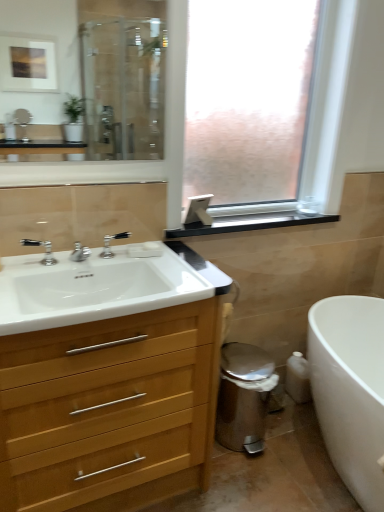
Question: Is white wood cabinet at left wider or thinner than frosted glass window at center?

Choices:
 (A) thin
 (B) wide

Answer: (B)

Question: Is point (18, 438) closer or farther from the camera than point (284, 61)?

Choices:
 (A) closer
 (B) farther

Answer: (A)

Question: Which is farther from the white matte soap at center?

Choices:
 (A) black matte window sill at upper center
 (B) white glossy bathtub at lower right
 (C) polished chrome faucet at center, the 1th tap viewed from the right
 (D) white wood cabinet at left
 (E) clear glass mirror at upper left

Answer: (E)

Question: Which object is positioned closest to the clear glass mirror at upper left?

Choices:
 (A) white matte soap at center
 (B) polished chrome faucet at center, the 2th tap viewed from the left
 (C) white glossy sink at left
 (D) polished chrome faucet at sink left, arranged as the second tap when viewed from the back
 (E) white wood cabinet at left

Answer: (C)